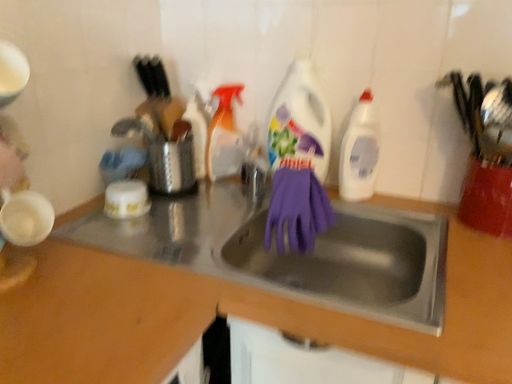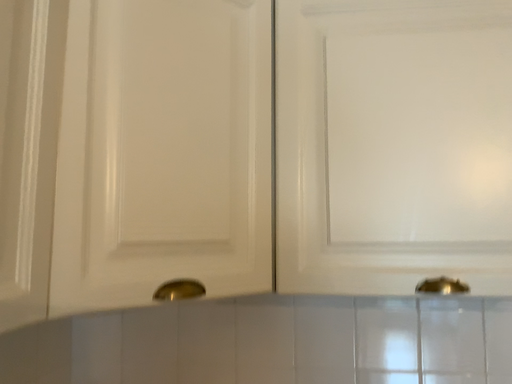
Question: Which way did the camera rotate in the video?

Choices:
 (A) rotated downward
 (B) rotated upward

Answer: (B)